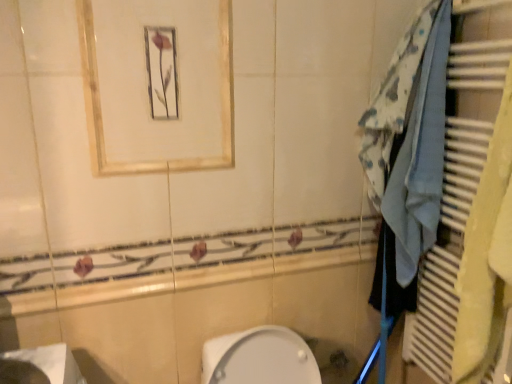
Question: Considering their positions, is white glossy sink at lower left located in front of or behind blue fabric towel at right?

Choices:
 (A) behind
 (B) front

Answer: (B)

Question: From the image's perspective, relative to blue fabric towel at right, is white glossy sink at lower left above or below?

Choices:
 (A) below
 (B) above

Answer: (A)

Question: Estimate the real-world distances between objects in this image. Which object is farther from the blue fabric towel at right?

Choices:
 (A) matte gold frame at upper center
 (B) white glossy sink at lower left
 (C) blue fabric at right

Answer: (B)

Question: Considering the real-world distances, which object is farthest from the matte gold frame at upper center?

Choices:
 (A) white glossy sink at lower left
 (B) blue fabric at right
 (C) blue fabric towel at right

Answer: (A)